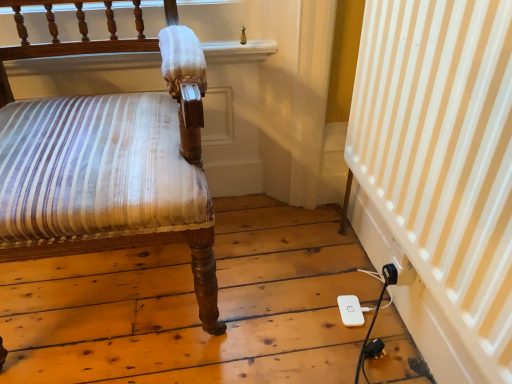
Identify the location of vacant area located to the right-hand side of white plastic ipod at lower right. The image size is (512, 384). (384, 310).